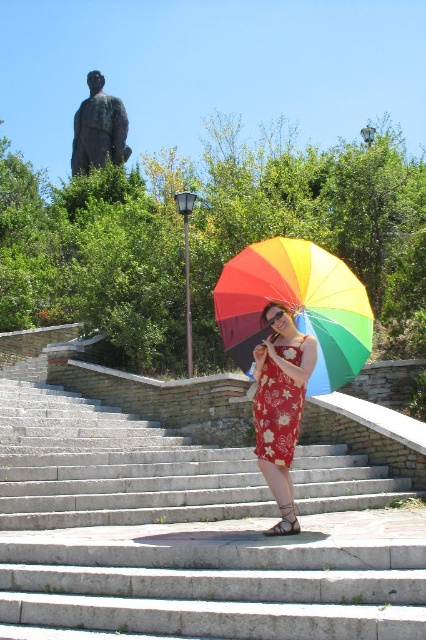
You are a photographer trying to capture a closeup of the rainbow fabric umbrella at center and the floral printed fabric dress at center. Given that your camera can only focus on objects within a 3 meter range, will you be able to capture both in focus?

The rainbow fabric umbrella at center and floral printed fabric dress at center are 3.90 meters apart from each other. Since the distance between them exceeds the 3 meter range, the camera cannot focus on both simultaneously.

You are a photographer trying to capture the rainbow fabric umbrella at center and the bronze statue at upper left in a single shot. Based on their positions, which object should you adjust your camera to focus on first if you want to include both in your frame?

The rainbow fabric umbrella at center is to the right of bronze statue at upper left, so you should focus on the bronze statue at upper left first to ensure both objects are included in the frame.

You are a photographer setting up for a shoot. The rainbow fabric umbrella at center and the bronze statue at upper left are in the frame. Which object is narrower in width?

The rainbow fabric umbrella at center is narrower than the bronze statue at upper left.